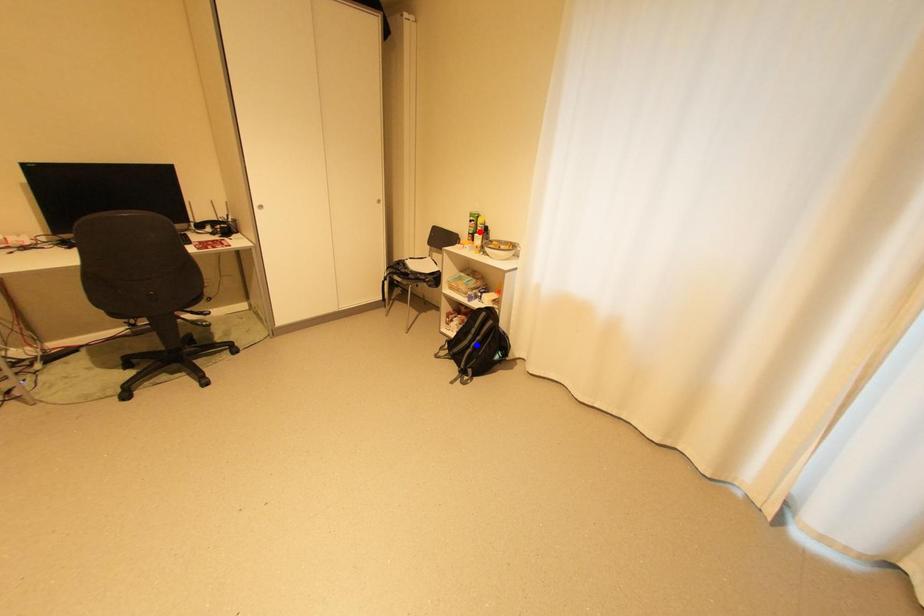
Question: Two points are marked on the image. Which point is closer to the camera?

Choices:
 (A) Blue point is closer.
 (B) Red point is closer.

Answer: (A)